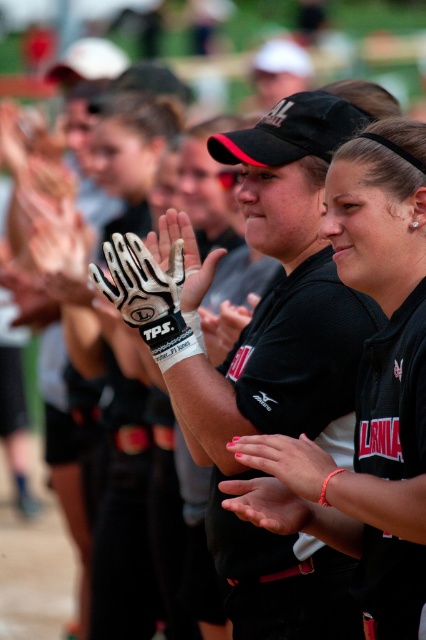
Between white matte baseball glove at center and pink matte nail polish at center, which one appears on the left side from the viewer's perspective?

Positioned to the left is white matte baseball glove at center.

You are a GUI agent. You are given a task and a screenshot of the screen. Output one action in this format:
    pyautogui.click(x=<x>, y=<y>)
    Task: Click on the white matte baseball glove at center
    
    Given the screenshot: What is the action you would take?
    pyautogui.click(x=155, y=276)

Is white matte baseball glove at center below white leather glove at center?

Indeed, white matte baseball glove at center is positioned under white leather glove at center.

Is white matte baseball glove at center above white leather glove at center?

No.

Does point (120, 250) lie in front of point (92, 244)?

Yes, it is in front of point (92, 244).

Identify the location of white matte baseball glove at center. Image resolution: width=426 pixels, height=640 pixels. (155, 276).

Does pink matte nail polish at center have a smaller size compared to white leather glove at center?

Yes, pink matte nail polish at center is smaller than white leather glove at center.

Describe the element at coordinates (293, 465) in the screenshot. I see `pink matte nail polish at center` at that location.

Describe the element at coordinates (293, 465) in the screenshot. I see `pink matte nail polish at center` at that location.

Where is `pink matte nail polish at center`? The width and height of the screenshot is (426, 640). pink matte nail polish at center is located at coordinates (293, 465).